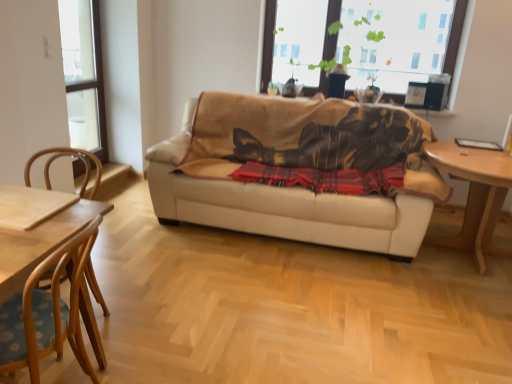
Question: Should I look upward or downward to see beige leather couch at center?

Choices:
 (A) up
 (B) down

Answer: (A)

Question: Can you confirm if beige leather couch at center is thinner than transparent glass window at upper left, the first window from the left?

Choices:
 (A) yes
 (B) no

Answer: (B)

Question: Is beige leather couch at center to the right of transparent glass window at upper left, the first window from the left, from the viewer's perspective?

Choices:
 (A) yes
 (B) no

Answer: (A)

Question: Can you confirm if beige leather couch at center is taller than transparent glass window at upper left, the first window from the left?

Choices:
 (A) yes
 (B) no

Answer: (B)

Question: From a real-world perspective, is beige leather couch at center on top of transparent glass window at upper left, the first window from the left?

Choices:
 (A) no
 (B) yes

Answer: (A)

Question: Is beige leather couch at center beside transparent glass window at upper left, the second window viewed from the right?

Choices:
 (A) yes
 (B) no

Answer: (B)

Question: Is beige leather couch at center not close to transparent glass window at upper left, the second window viewed from the right?

Choices:
 (A) yes
 (B) no

Answer: (A)

Question: Is the position of light brown wooden table at right less distant than that of wooden chair at left, which is counted as the second chair, starting from the back?

Choices:
 (A) no
 (B) yes

Answer: (A)

Question: From a real-world perspective, is light brown wooden table at right on top of wooden chair at left, which is counted as the second chair, starting from the back?

Choices:
 (A) yes
 (B) no

Answer: (A)

Question: Is wooden chair at left, the 1th chair positioned from the front, completely or partially inside light brown wooden table at right?

Choices:
 (A) no
 (B) yes

Answer: (A)

Question: From a real-world perspective, is light brown wooden table at right located beneath wooden chair at left, which is counted as the second chair, starting from the back?

Choices:
 (A) no
 (B) yes

Answer: (A)

Question: Is light brown wooden table at right wider than wooden chair at left, the 1th chair positioned from the front?

Choices:
 (A) yes
 (B) no

Answer: (A)

Question: Is light brown wooden table at right further to camera compared to wooden chair at left, which is counted as the second chair, starting from the back?

Choices:
 (A) yes
 (B) no

Answer: (A)

Question: Can you confirm if light brown wooden table at right is positioned to the left of transparent glass window at upper left, the first window from the left?

Choices:
 (A) yes
 (B) no

Answer: (B)